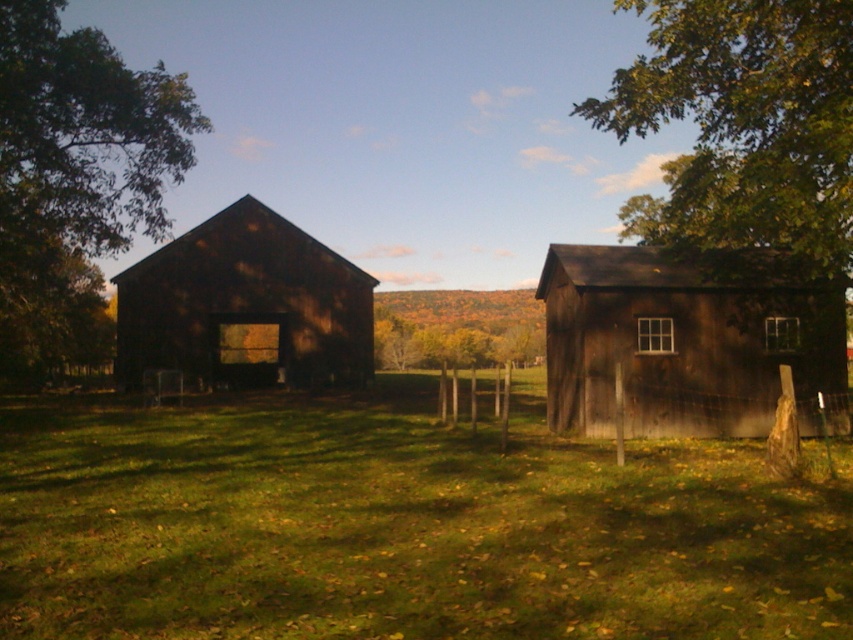
You are standing at the point marked by the coordinate point (x=402, y=524) in the image. What is the name of the object you are currently standing on?

The green grass at center is located at point (x=402, y=524), so you are standing on the green grass at center.

You are a gardener planning to mow the lawn in the rural scene. You have a lawnmower that can only handle areas where the grass is not too large. Based on the image, will the green grass at center be manageable for your lawnmower compared to the green matte tree at left?

The green grass at center occupies less space than the green matte tree at left, so it will be more manageable for your lawnmower.